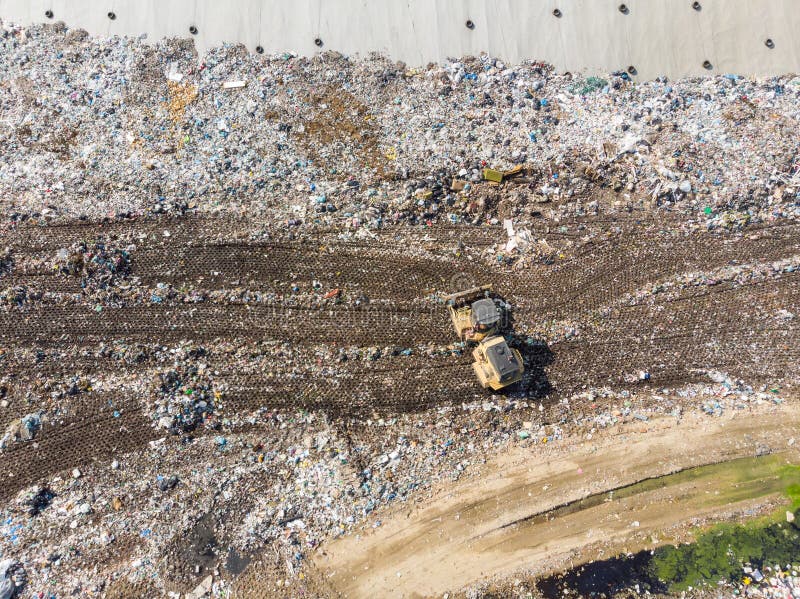
Find the location of a particular element. The image size is (800, 599). port in wall is located at coordinates (560, 13), (470, 23), (625, 9).